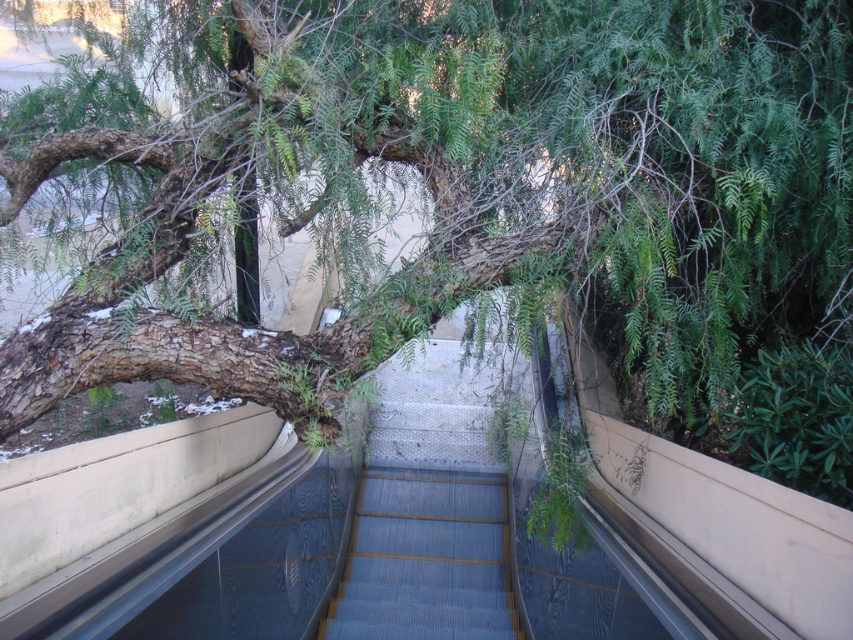
Who is higher up, green leafy tree at upper left or smooth blue stairs at center?

green leafy tree at upper left is higher up.

Is green leafy tree at upper left closer to camera compared to smooth blue stairs at center?

Yes, it is.

Measure the distance between green leafy tree at upper left and camera.

2.26 meters

Find the location of a particular element. The height and width of the screenshot is (640, 853). green leafy tree at upper left is located at coordinates (467, 182).